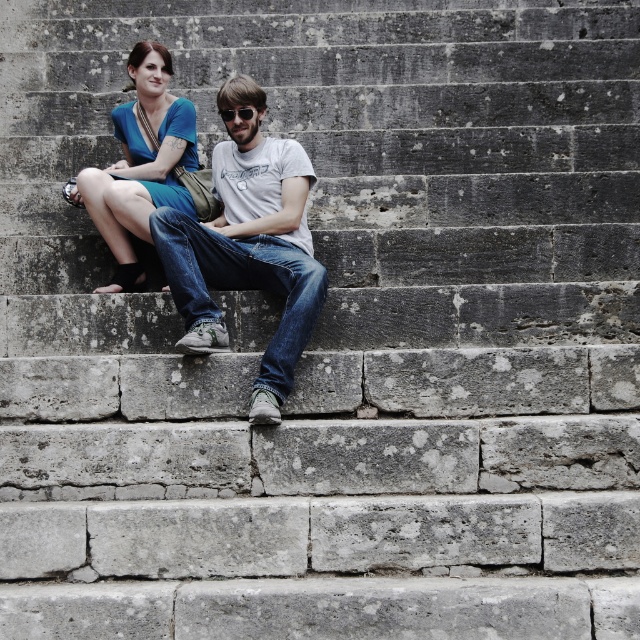
Is matte blue dress at center positioned behind black matte sunglasses at center?

No.

Does point (125, 225) lie in front of point (237, 106)?

Yes, point (125, 225) is closer to viewer.

This screenshot has height=640, width=640. Identify the location of matte blue dress at center. (140, 164).

Image resolution: width=640 pixels, height=640 pixels. I want to click on matte blue dress at center, so pos(140,164).

Does denim jeans at center have a lesser height compared to matte blue dress at center?

No.

This screenshot has width=640, height=640. What do you see at coordinates (248, 248) in the screenshot?
I see `denim jeans at center` at bounding box center [248, 248].

Find the location of a particular element. The image size is (640, 640). denim jeans at center is located at coordinates (248, 248).

Is denim jeans at center bigger than black matte sunglasses at center?

Yes, denim jeans at center is bigger than black matte sunglasses at center.

Can you confirm if denim jeans at center is positioned below black matte sunglasses at center?

Yes, denim jeans at center is below black matte sunglasses at center.

Is point (179, 294) behind point (241, 116)?

That is False.

At what (x,y) coordinates should I click in order to perform the action: click on denim jeans at center. Please return your answer as a coordinate pair (x, y). Looking at the image, I should click on (248, 248).